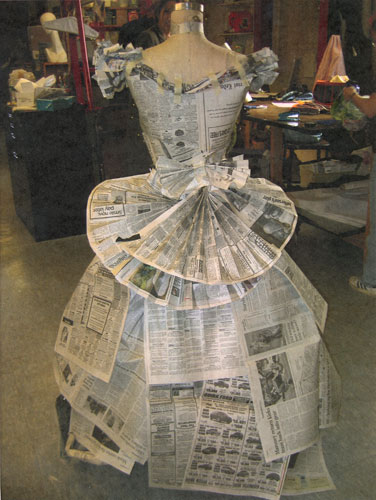
Locate an element on the screen. The height and width of the screenshot is (500, 376). drawer is located at coordinates (14, 171).